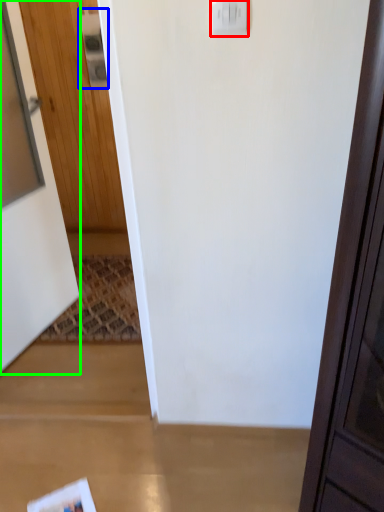
Question: Considering the real-world distances, which object is farthest from light switch (highlighted by a red box)? light switch (highlighted by a blue box) or door (highlighted by a green box)?

Choices:
 (A) light switch
 (B) door

Answer: (A)